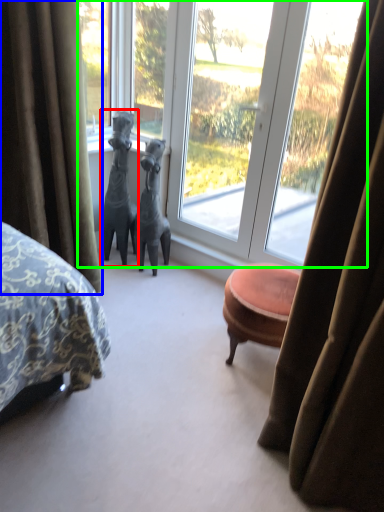
Question: Which is farther away from animal (highlighted by a red box)? curtain (highlighted by a blue box) or window (highlighted by a green box)?

Choices:
 (A) curtain
 (B) window

Answer: (A)